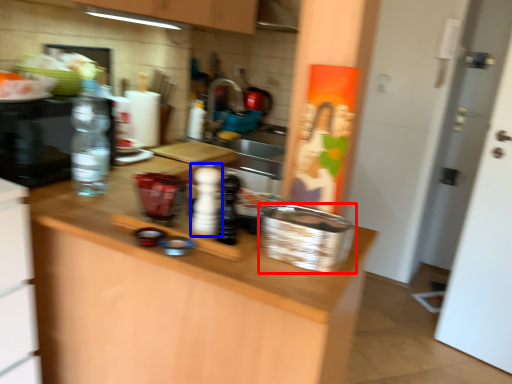
Question: Which point is closer to the camera, basket (highlighted by a red box) or bottle (highlighted by a blue box)?

Choices:
 (A) basket
 (B) bottle

Answer: (A)